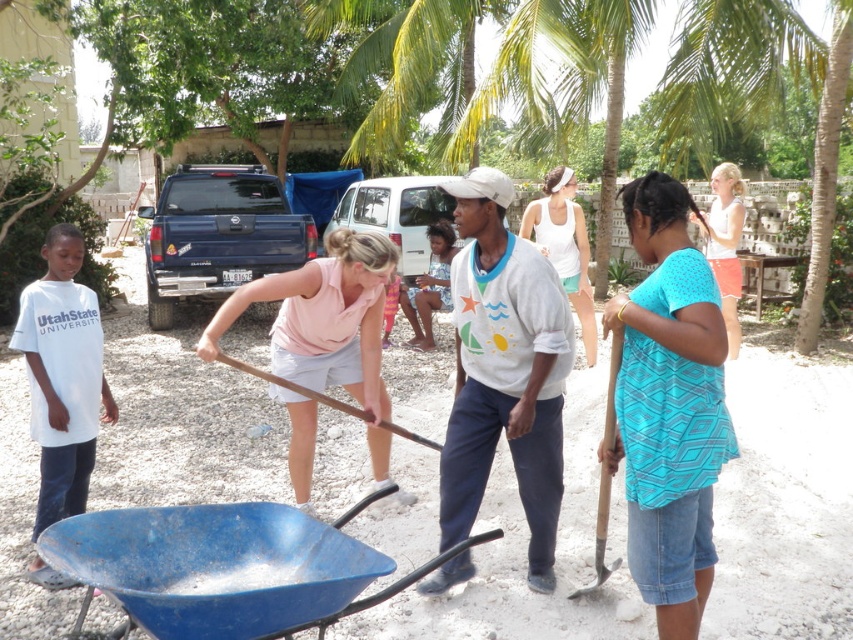
You are a photographer trying to capture a candid shot of both the pink fabric shirt at center and the white tank top at upper right. Since you want to ensure both subjects are in focus, you need to know their heights relative to each other. Which clothing item is taller?

The pink fabric shirt at center is taller than the white tank top at upper right.